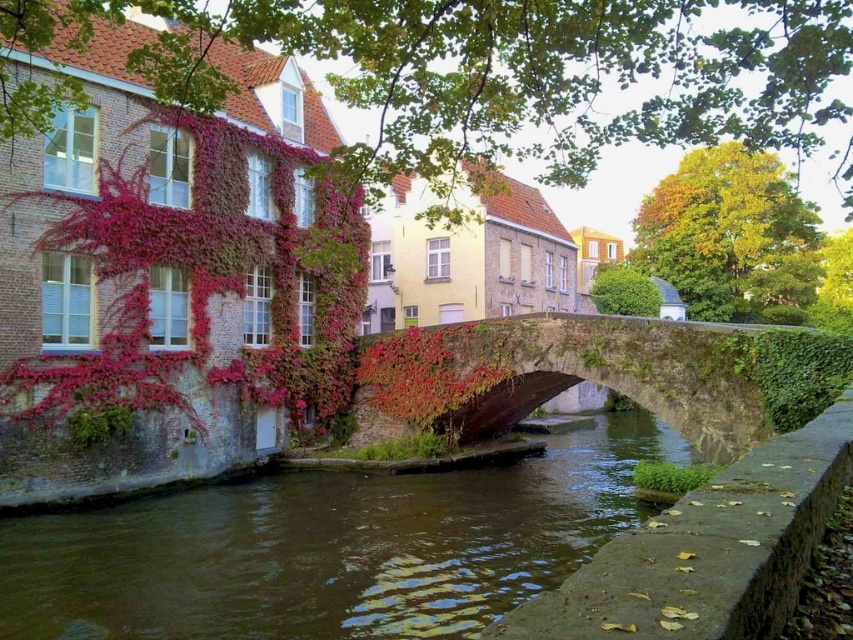
Question: Can you confirm if brown stone river at center is bigger than stone bridge at center?

Choices:
 (A) no
 (B) yes

Answer: (A)

Question: Observing the image, what is the correct spatial positioning of brown stone river at center in reference to stone bridge at center?

Choices:
 (A) right
 (B) left

Answer: (B)

Question: Among these objects, which one is nearest to the camera?

Choices:
 (A) brown stone river at center
 (B) stone bridge at center

Answer: (B)

Question: Can you confirm if brown stone river at center is smaller than stone bridge at center?

Choices:
 (A) yes
 (B) no

Answer: (A)